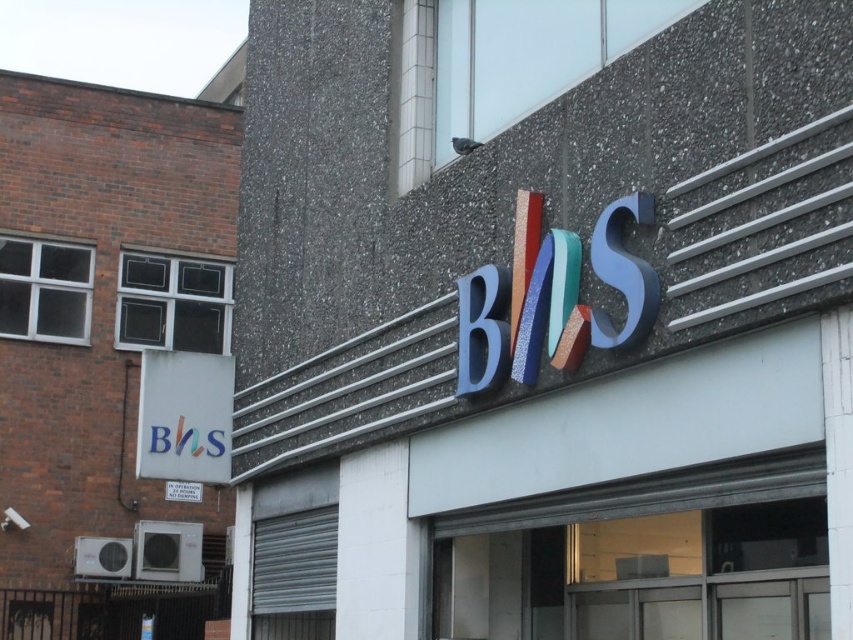
Question: Is multicolored plastic sign at center in front of matte white sign at lower left?

Choices:
 (A) no
 (B) yes

Answer: (B)

Question: From the image, what is the correct spatial relationship of multicolored plastic sign at center in relation to matte white sign at lower left?

Choices:
 (A) above
 (B) below

Answer: (A)

Question: Does multicolored plastic sign at center have a smaller size compared to matte white sign at lower left?

Choices:
 (A) no
 (B) yes

Answer: (A)

Question: Which of the following is the farthest from the observer?

Choices:
 (A) multicolored plastic sign at center
 (B) matte white sign at lower left

Answer: (B)

Question: Which point is farther from the camera taking this photo?

Choices:
 (A) (554, 477)
 (B) (192, 480)

Answer: (B)